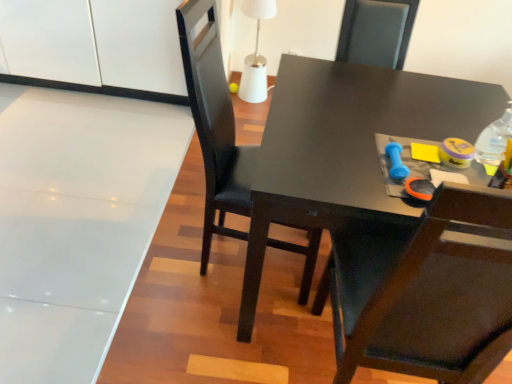
I want to click on free spot in front of blue rubber dumbbell at upper right, so click(383, 195).